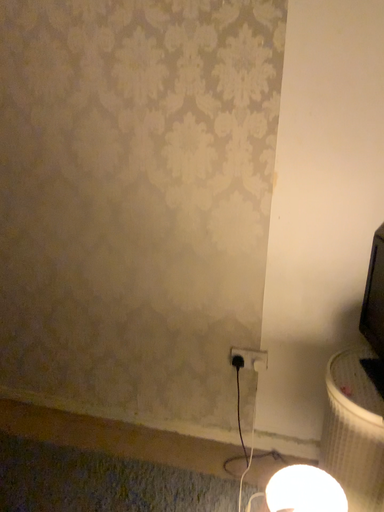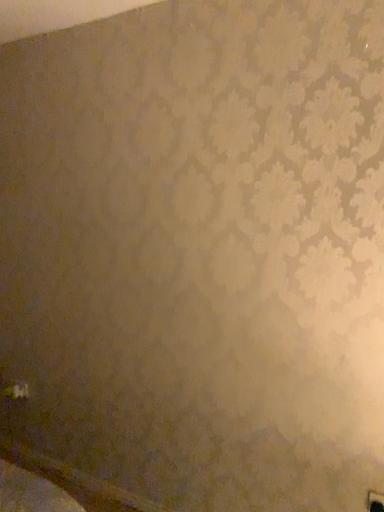
Question: Which way did the camera rotate in the video?

Choices:
 (A) rotated left
 (B) rotated right

Answer: (A)